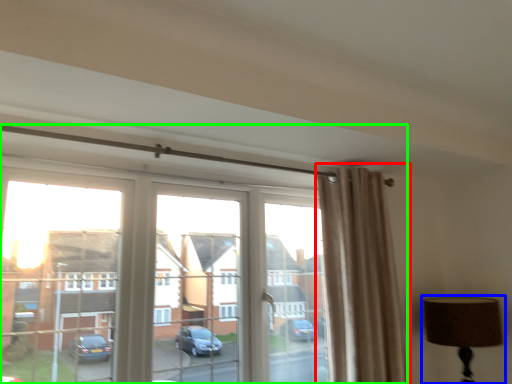
Question: Estimate the real-world distances between objects in this image. Which object is farther from curtain (highlighted by a red box), table lamp (highlighted by a blue box) or window (highlighted by a green box)?

Choices:
 (A) table lamp
 (B) window

Answer: (B)